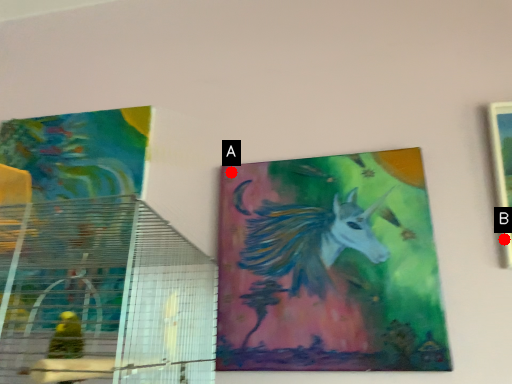
Question: Two points are circled on the image, labeled by A and B beside each circle. Among these points, which one is farthest from the camera?

Choices:
 (A) A is further
 (B) B is further

Answer: (A)